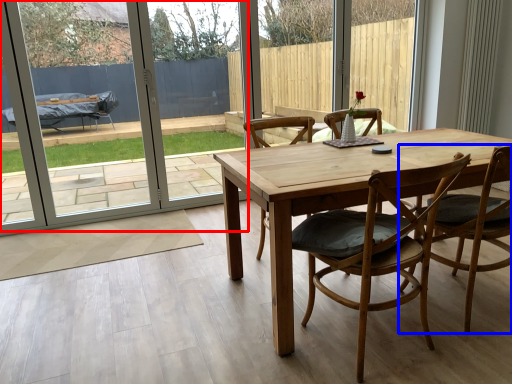
Question: Which of the following is the closest to the observer, screen door (highlighted by a red box) or chair (highlighted by a blue box)?

Choices:
 (A) screen door
 (B) chair

Answer: (B)